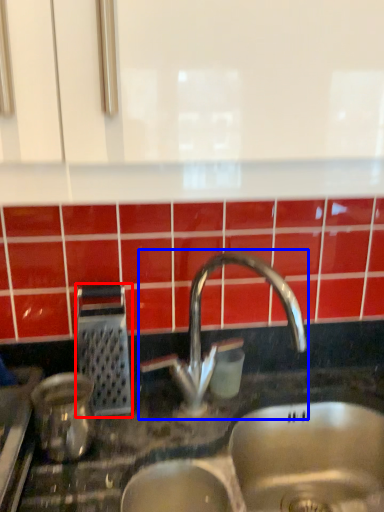
Question: Which object is closer to the camera taking this photo, appliance (highlighted by a red box) or tap (highlighted by a blue box)?

Choices:
 (A) appliance
 (B) tap

Answer: (B)